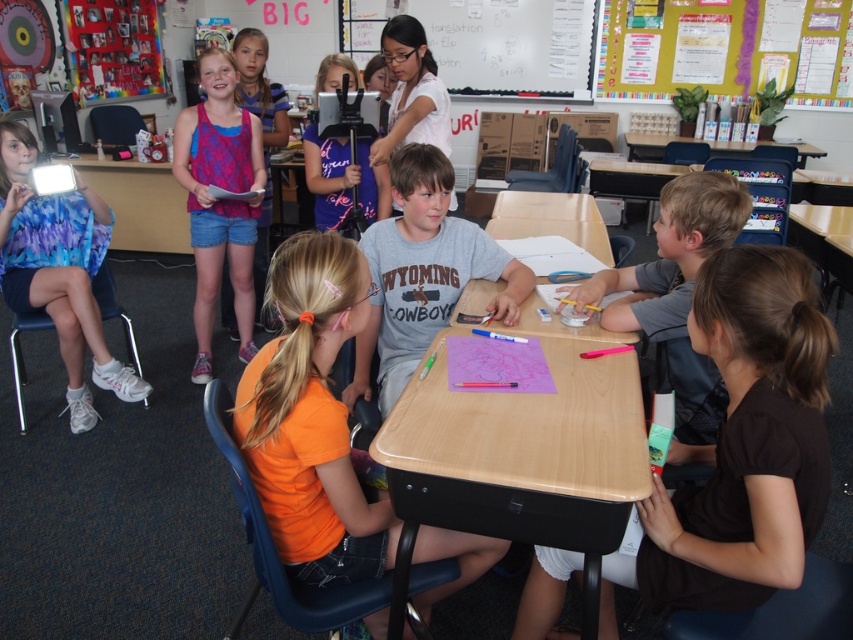
Does brown matte shirt at lower right have a larger size compared to matte black tablet at center?

Yes.

Can you confirm if brown matte shirt at lower right is thinner than matte black tablet at center?

Incorrect, brown matte shirt at lower right's width is not less than matte black tablet at center's.

Is point (782, 291) positioned in front of point (363, 188)?

Yes, point (782, 291) is closer to viewer.

Where is `brown matte shirt at lower right`? The height and width of the screenshot is (640, 853). brown matte shirt at lower right is located at coordinates (746, 440).

Which is in front, point (740, 257) or point (358, 243)?

Positioned in front is point (740, 257).

Does brown matte shirt at lower right have a smaller size compared to gray cotton shirt at center?

Actually, brown matte shirt at lower right might be larger than gray cotton shirt at center.

Does point (750, 252) come farther from viewer compared to point (399, 323)?

That is False.

At what (x,y) coordinates should I click in order to perform the action: click on brown matte shirt at lower right. Please return your answer as a coordinate pair (x, y). Looking at the image, I should click on (746, 440).

Is orange t-shirt at center taller than matte black tablet at center?

Yes, orange t-shirt at center is taller than matte black tablet at center.

Does orange t-shirt at center appear on the right side of matte black tablet at center?

Correct, you'll find orange t-shirt at center to the right of matte black tablet at center.

Is point (271, 476) positioned after point (350, 161)?

No, (271, 476) is in front of (350, 161).

This screenshot has height=640, width=853. What are the coordinates of `orange t-shirt at center` in the screenshot? It's located at (312, 419).